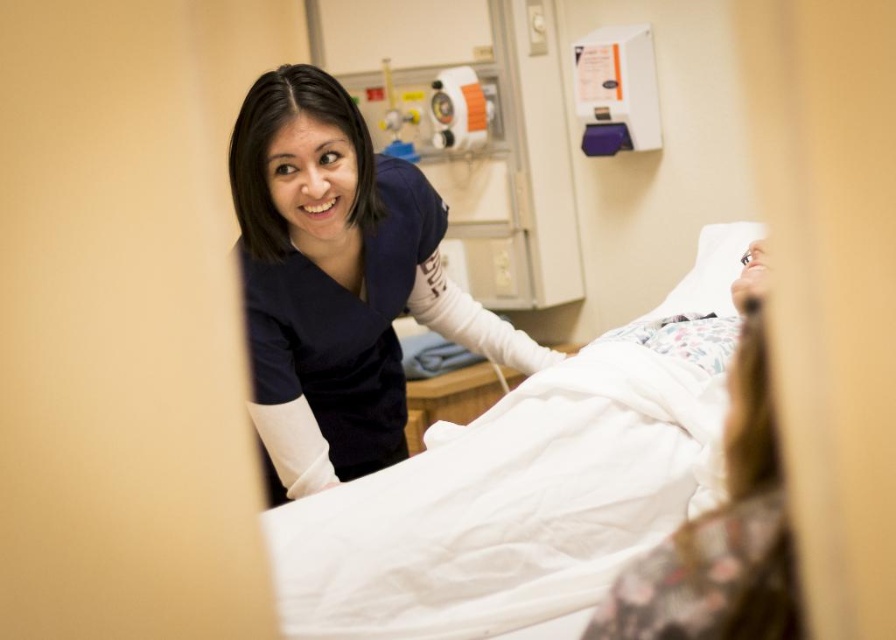
You are a delivery person who needs to place a package on the bed. The package requires a surface area of 0.6 square meters. Can the white smooth bed at center accommodate the package?

The position of white smooth bed at center is at point (x=527, y=484). However, the bed dimensions are not provided in the description, so it is impossible to determine if it can accommodate the package.

You are a patient in the hospital bed and need to reach the navy blue scrubs at upper center. Based on their position, can you estimate if they are within arm reach from your current position in the bed?

The navy blue scrubs at upper center is located at point (338, 282), which would likely be within arm reach from the hospital bed, assuming standard bed dimensions and typical human arm length.